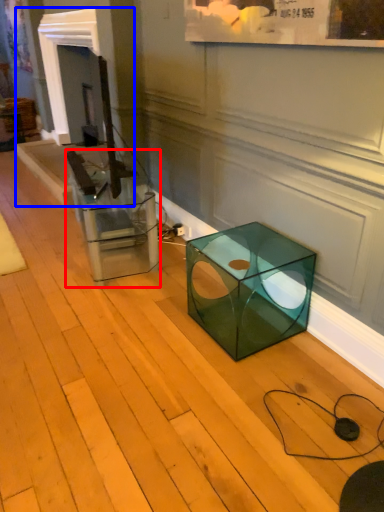
Question: Which point is further to the camera, glass box (highlighted by a red box) or fireplace (highlighted by a blue box)?

Choices:
 (A) glass box
 (B) fireplace

Answer: (B)